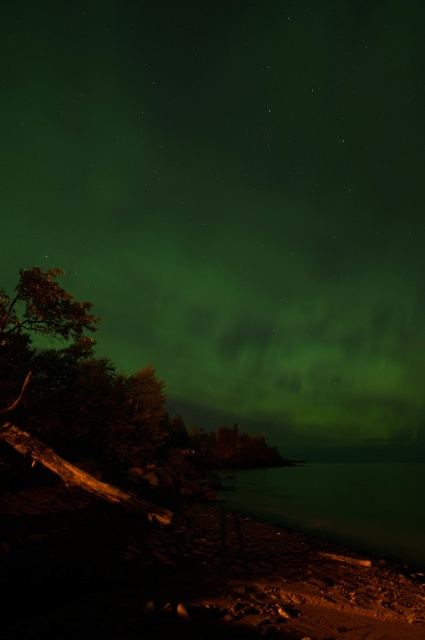
Is green leafy tree at left wider than green translucent water at lower center?

Incorrect, green leafy tree at left's width does not surpass green translucent water at lower center's.

Does point (45, 432) come behind point (351, 458)?

That is False.

Which is behind, point (50, 296) or point (235, 499)?

Positioned behind is point (235, 499).

Locate an element on the screen. This screenshot has height=640, width=425. green leafy tree at left is located at coordinates (73, 378).